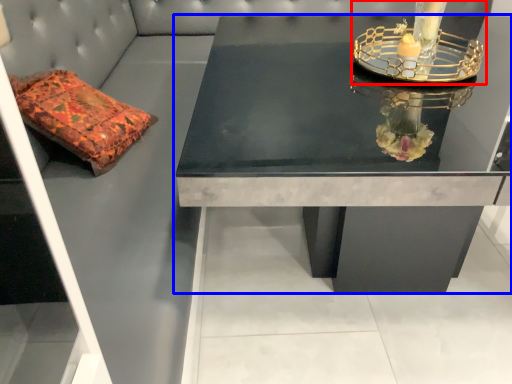
Question: Among these objects, which one is farthest to the camera, candle holder (highlighted by a red box) or table (highlighted by a blue box)?

Choices:
 (A) candle holder
 (B) table

Answer: (A)